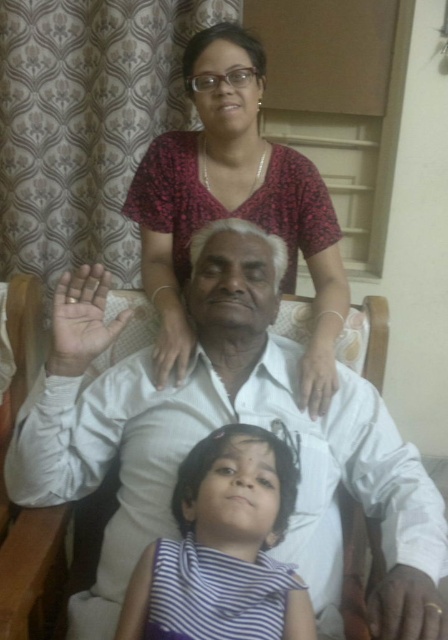
Between matte floral blouse at upper center and striped fabric at lower center, which one has less height?

Standing shorter between the two is striped fabric at lower center.

Is matte floral blouse at upper center bigger than striped fabric at lower center?

Yes.

Which is in front, point (284, 284) or point (246, 449)?

Point (246, 449) is more forward.

The height and width of the screenshot is (640, 448). I want to click on matte floral blouse at upper center, so click(235, 204).

Who is shorter, white smooth shirt at center or striped fabric at lower center?

striped fabric at lower center is shorter.

Looking at this image, who is positioned more to the right, white smooth shirt at center or striped fabric at lower center?

white smooth shirt at center is more to the right.

Between point (192, 400) and point (272, 598), which one is positioned in front?

Point (272, 598) is in front.

The width and height of the screenshot is (448, 640). What are the coordinates of `white smooth shirt at center` in the screenshot? It's located at point(218,426).

Which is more to the left, white smooth shirt at center or matte floral blouse at upper center?

From the viewer's perspective, matte floral blouse at upper center appears more on the left side.

Is point (211, 276) positioned in front of point (339, 296)?

Yes, it is.

Locate an element on the screen. white smooth shirt at center is located at coordinates (218, 426).